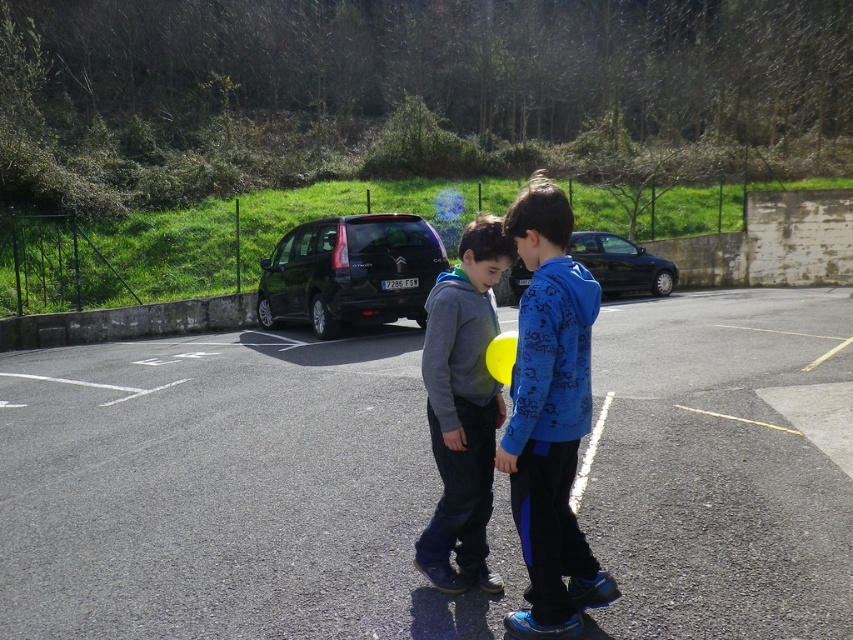
Who is more distant from viewer, (x=547, y=611) or (x=567, y=252)?

Positioned behind is point (x=567, y=252).

The height and width of the screenshot is (640, 853). What do you see at coordinates (550, 417) in the screenshot?
I see `blue fleece jacket at center` at bounding box center [550, 417].

Image resolution: width=853 pixels, height=640 pixels. In order to click on blue fleece jacket at center in this screenshot , I will do `click(550, 417)`.

Can you confirm if asphalt at center is shorter than blue fleece jacket at center?

No, asphalt at center is not shorter than blue fleece jacket at center.

Image resolution: width=853 pixels, height=640 pixels. What do you see at coordinates (227, 492) in the screenshot?
I see `asphalt at center` at bounding box center [227, 492].

Identify the location of asphalt at center. (227, 492).

What do you see at coordinates (463, 408) in the screenshot? I see `gray fleece hoodie at center` at bounding box center [463, 408].

Does gray fleece hoodie at center come behind black matte van at center?

No, it is not.

What are the coordinates of `gray fleece hoodie at center` in the screenshot? It's located at (463, 408).